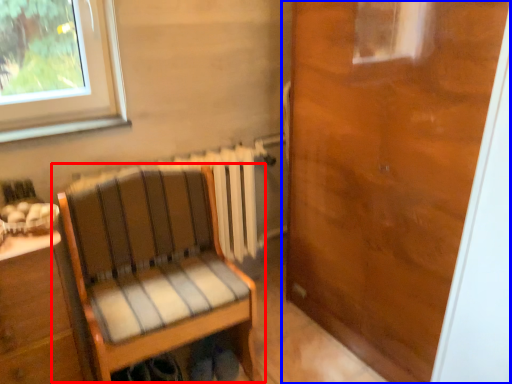
Question: Which of the following is the farthest to the observer, chair (highlighted by a red box) or door (highlighted by a blue box)?

Choices:
 (A) chair
 (B) door

Answer: (A)